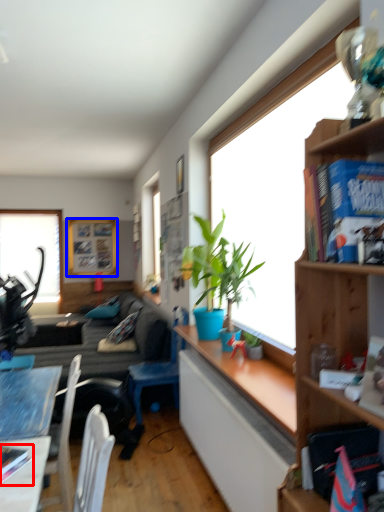
Question: Among these objects, which one is farthest to the camera, book (highlighted by a red box) or picture frame (highlighted by a blue box)?

Choices:
 (A) book
 (B) picture frame

Answer: (B)